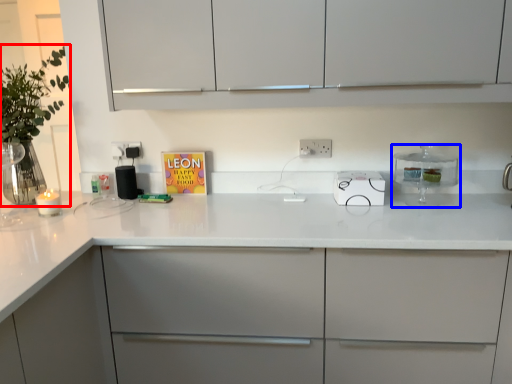
Question: Which object appears farthest to the camera in this image, plant (highlighted by a red box) or kitchen appliance (highlighted by a blue box)?

Choices:
 (A) plant
 (B) kitchen appliance

Answer: (B)